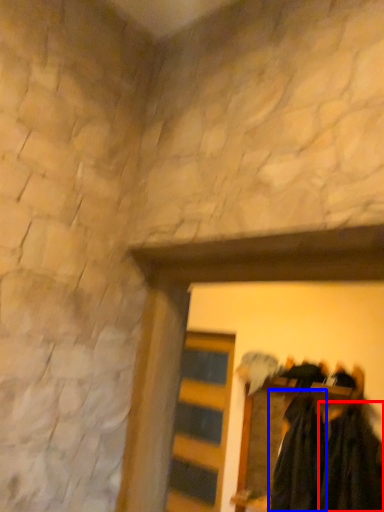
Question: Which point is further to the camera, clothing (highlighted by a red box) or clothing (highlighted by a blue box)?

Choices:
 (A) clothing
 (B) clothing

Answer: (B)